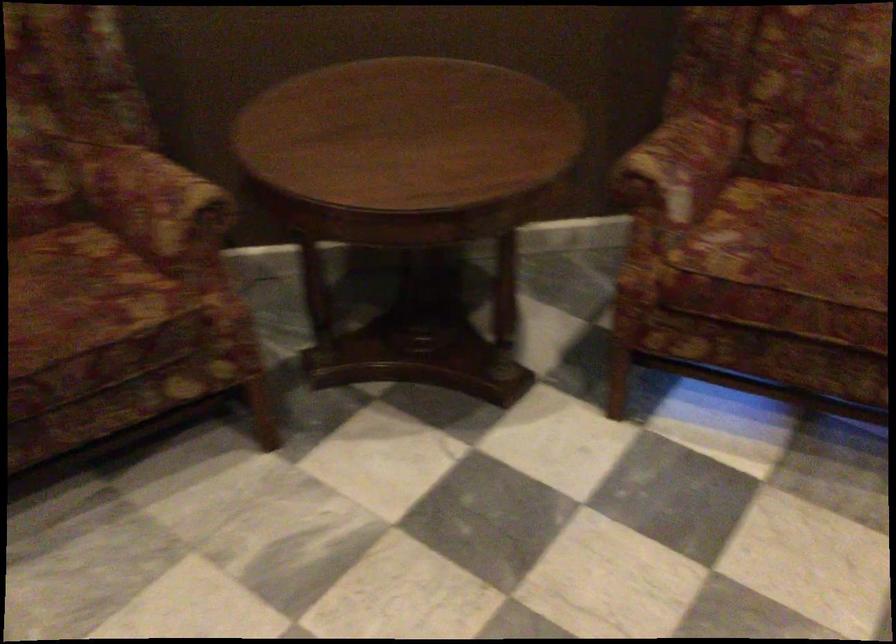
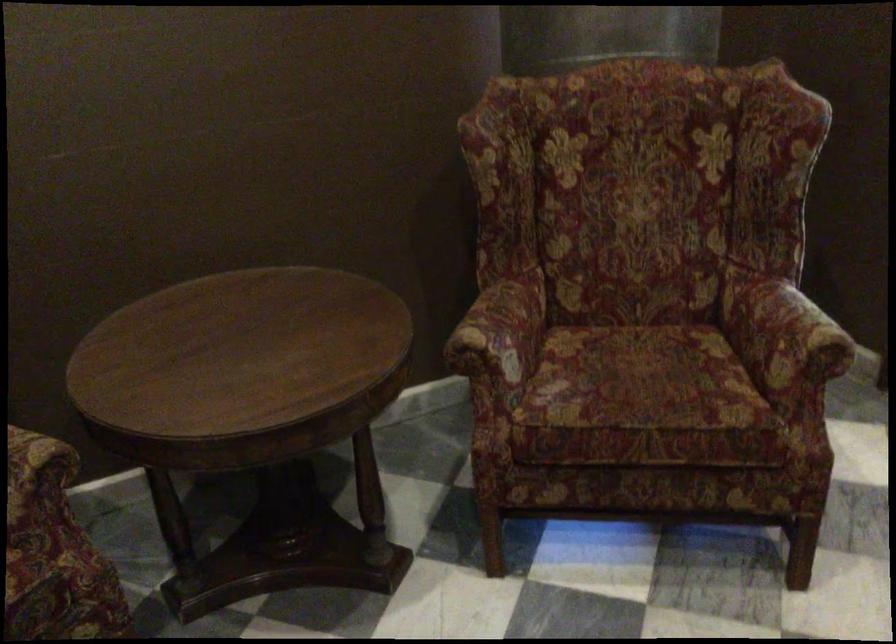
Where in the second image is the point corresponding to (817,249) from the first image?

(642, 381)